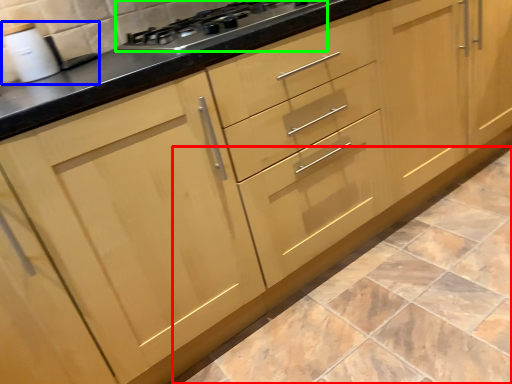
Question: Based on their relative distances, which object is nearer to ceramic tile (highlighted by a red box)? Choose from sink (highlighted by a blue box) and gas stove (highlighted by a green box).

Choices:
 (A) sink
 (B) gas stove

Answer: (B)